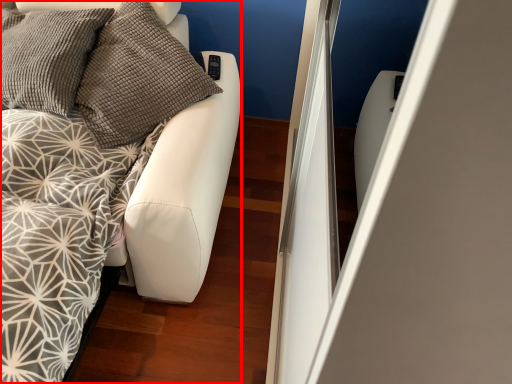
Question: In this image, where is furniture (annotated by the red box) located relative to pillow?

Choices:
 (A) left
 (B) right

Answer: (A)